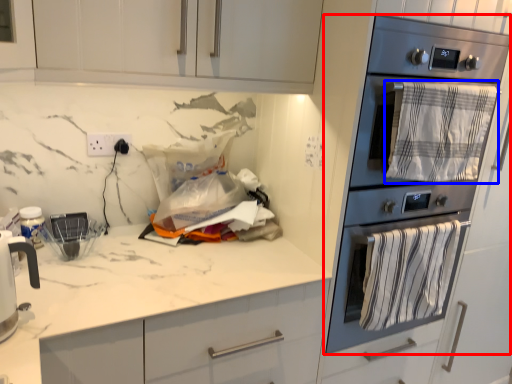
Question: Among these objects, which one is nearest to the camera, kitchen appliance (highlighted by a red box) or blanket (highlighted by a blue box)?

Choices:
 (A) kitchen appliance
 (B) blanket

Answer: (A)